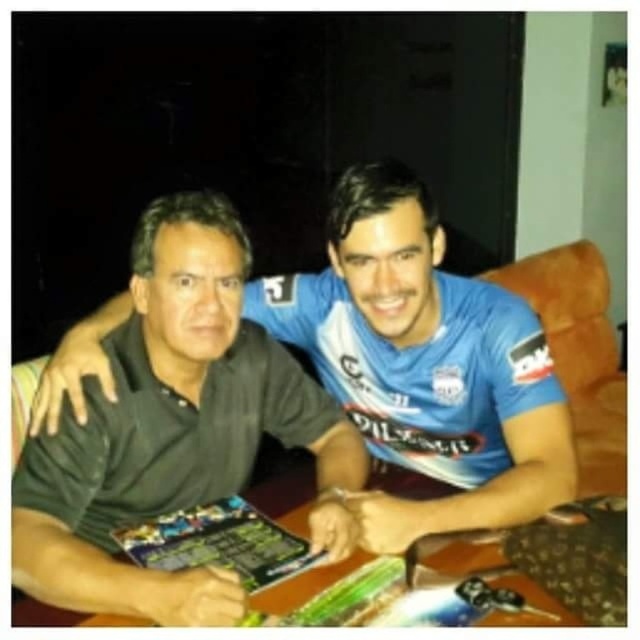
Please describe the position of the black matte shirt at center in the image using coordinates. The image has a coordinate system where the bottom left corner is the origin point. The x and y axes increase to the right and up respectively. The coordinates are normalized between 0 and 1. For example, the center of the image would be at approximately 0.5, 0.5. Please provide the coordinates with three decimal places of precision.

The black matte shirt at center is located at coordinates point (173, 429).

You are a photographer setting up a shoot in this scene. You need to place a small prop between the black matte shirt at center and the wooden table at center. Based on their relative sizes, which object should the prop be placed closer to?

The black matte shirt at center is thinner than the wooden table at center, so the prop should be placed closer to the wooden table at center to maintain balance between the two objects.

You are a photographer trying to capture a closeup of the black matte shirt at center and the wooden table at center. Since the camera can only focus on one object at a time, which object should you choose to ensure the larger one is in focus?

The black matte shirt at center has a larger size compared to the wooden table at center, so you should focus on the black matte shirt at center to ensure the larger object is in focus.